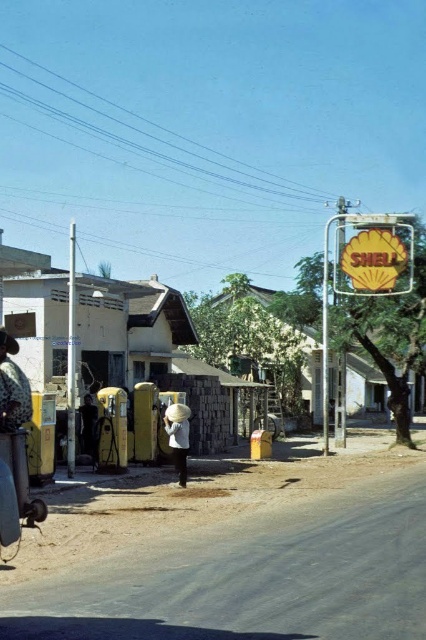
Question: Can you confirm if white fabric basket at center is wider than light brown straw hat at center?

Choices:
 (A) no
 (B) yes

Answer: (A)

Question: Which point is farther from the camera taking this photo?

Choices:
 (A) (184, 406)
 (B) (11, 403)

Answer: (A)

Question: Is spotted fabric hat at left closer to camera compared to light brown straw hat at center?

Choices:
 (A) yes
 (B) no

Answer: (A)

Question: Among these objects, which one is nearest to the camera?

Choices:
 (A) light brown straw hat at center
 (B) white fabric basket at center
 (C) spotted fabric hat at left

Answer: (C)

Question: Among these points, which one is nearest to the camera?

Choices:
 (A) (2, 426)
 (B) (173, 419)

Answer: (A)

Question: Is white fabric basket at center positioned in front of light brown straw hat at center?

Choices:
 (A) yes
 (B) no

Answer: (A)